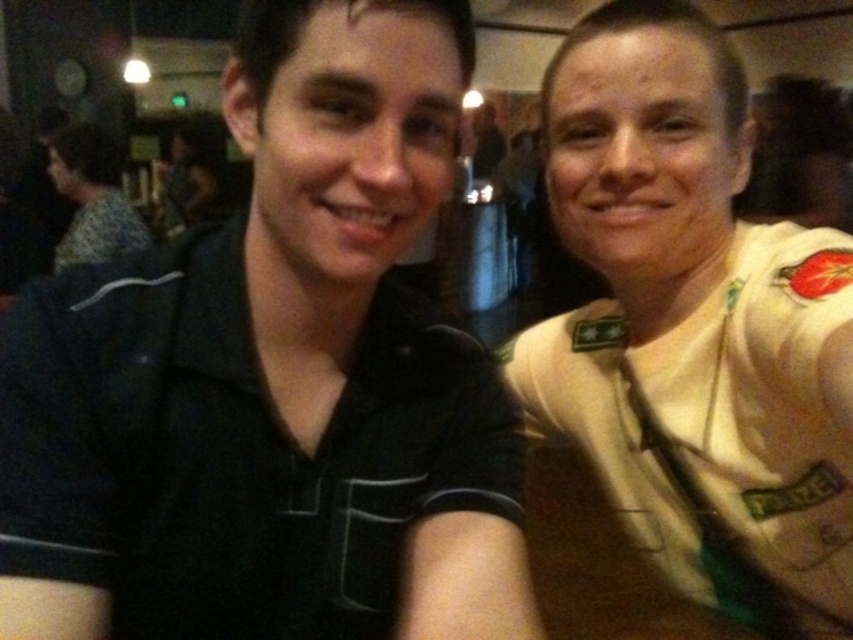
Is point (448, 602) positioned after point (90, 193)?

No, it is not.

Can you confirm if black matte shirt at center is smaller than matte black shirt at left?

Correct, black matte shirt at center occupies less space than matte black shirt at left.

Identify the location of black matte shirt at center. (281, 371).

Is white uniform shirt at right positioned at the back of matte black shirt at left?

No, it is not.

Is white uniform shirt at right thinner than matte black shirt at left?

Yes.

This screenshot has height=640, width=853. I want to click on white uniform shirt at right, so click(x=694, y=326).

Which of these two, black matte shirt at center or white uniform shirt at right, stands taller?

Standing taller between the two is white uniform shirt at right.

Is point (78, 572) positioned in front of point (787, 627)?

Yes, point (78, 572) is closer to viewer.

I want to click on black matte shirt at center, so click(x=281, y=371).